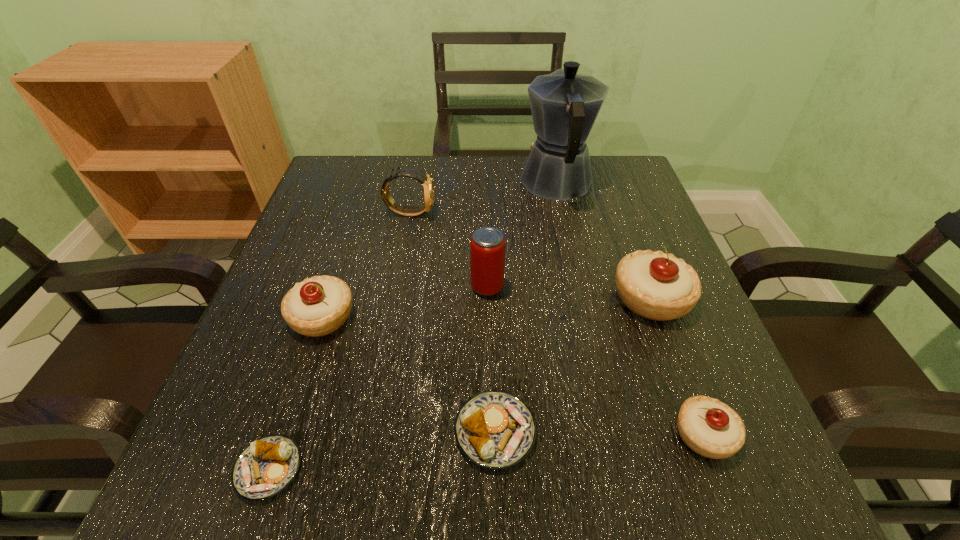
At what (x,y) coordinates should I click in order to perform the action: click on the bigger brown pastry. Please return your answer as a coordinate pair (x, y). Looking at the image, I should click on (494, 429).

In order to click on the smaller brown pastry in this screenshot , I will do `click(267, 466)`.

At what (x,y) coordinates should I click in order to perform the action: click on the left brown pastry. Please return your answer as a coordinate pair (x, y). Looking at the image, I should click on (267, 466).

This screenshot has width=960, height=540. What are the coordinates of `vacant space located 0.210m on the right of the beer can` in the screenshot? It's located at [x=612, y=286].

Identify the location of free space located on the face of the gold watch. This screenshot has width=960, height=540. pyautogui.click(x=460, y=213).

Image resolution: width=960 pixels, height=540 pixels. I want to click on blank space located on the back of the biggest beige pastry, so click(x=614, y=199).

This screenshot has height=540, width=960. In order to click on vacant point located on the left of the fourth shortest pastry in this screenshot , I will do `click(256, 317)`.

Identify the location of free region located on the left of the sixth tallest object. The image size is (960, 540). (578, 434).

The height and width of the screenshot is (540, 960). I want to click on free space located 0.140m on the right of the right brown pastry, so click(631, 431).

At what (x,y) coordinates should I click in order to perform the action: click on free space located 0.180m on the right of the shortest pastry. Please return your answer as a coordinate pair (x, y). The height and width of the screenshot is (540, 960). Looking at the image, I should click on (431, 469).